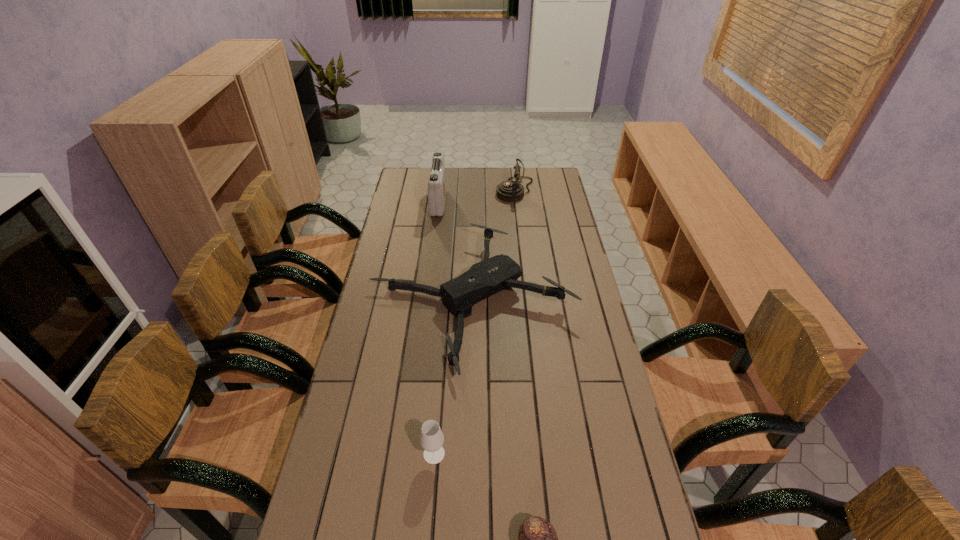
Identify the location of telephone at the far edge. This screenshot has height=540, width=960. (510, 191).

In order to click on object present at the left edge in this screenshot , I will do `click(492, 275)`.

At what (x,y) coordinates should I click in order to perform the action: click on telephone located in the right edge section of the desktop. Please return your answer as a coordinate pair (x, y). The image size is (960, 540). Looking at the image, I should click on (510, 191).

This screenshot has height=540, width=960. I want to click on drone at the right edge, so click(492, 275).

Locate an element on the screen. object that is at the far right corner is located at coordinates (510, 191).

Locate an element on the screen. This screenshot has height=540, width=960. vacant point at the far edge is located at coordinates (468, 168).

In the image, there is a desktop. At what (x,y) coordinates should I click in order to perform the action: click on vacant space at the left edge. Please return your answer as a coordinate pair (x, y). Looking at the image, I should click on (372, 518).

I want to click on vacant position at the right edge of the desktop, so [594, 320].

In the image, there is a desktop. What are the coordinates of `free space at the far left corner` in the screenshot? It's located at (404, 170).

Identify the location of vacant space at the far right corner of the desktop. (539, 176).